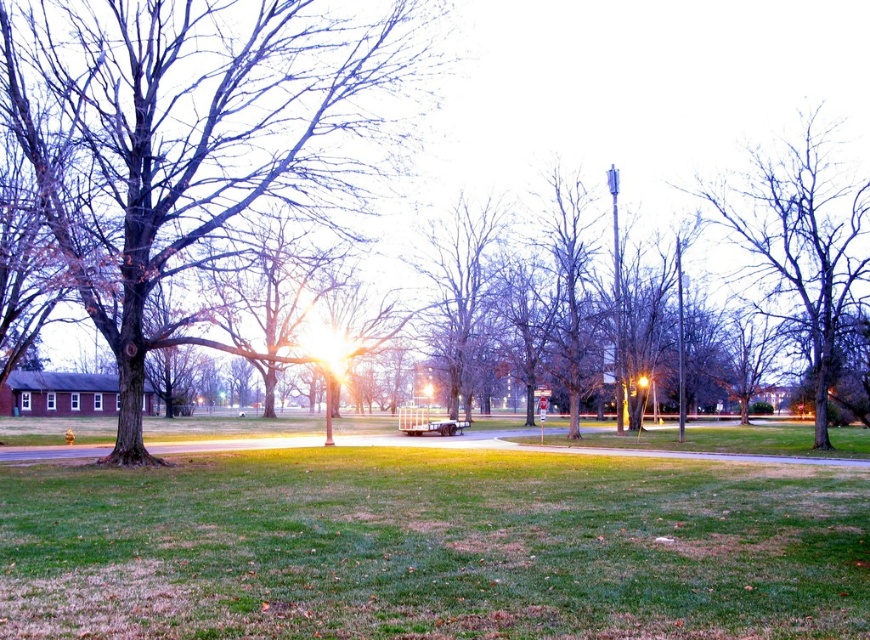
Question: Considering the real-world distances, which object is farthest from the bare wood tree at center?

Choices:
 (A) green grassy field at center
 (B) bare wood tree at left

Answer: (A)

Question: Is bare wood tree at left to the right of bare wood tree at center from the viewer's perspective?

Choices:
 (A) yes
 (B) no

Answer: (B)

Question: Can you confirm if bare wood tree at left is wider than bare wood tree at upper right?

Choices:
 (A) no
 (B) yes

Answer: (B)

Question: Can you confirm if bare wood tree at upper right is smaller than bare wood tree at center?

Choices:
 (A) no
 (B) yes

Answer: (B)

Question: Based on their relative distances, which object is farther from the bare wood tree at left?

Choices:
 (A) bare wood tree at upper right
 (B) bare wood tree at center
 (C) green grassy field at center

Answer: (A)

Question: Which is nearer to the green grassy field at center?

Choices:
 (A) bare wood tree at left
 (B) bare wood tree at center

Answer: (A)